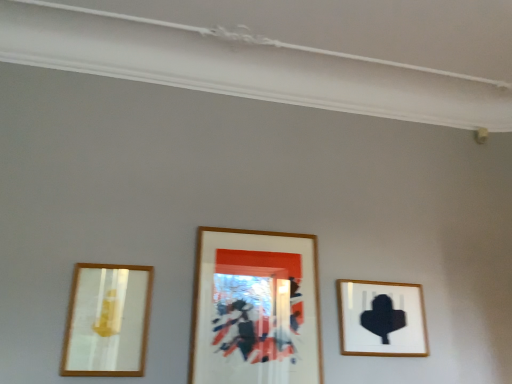
Question: Is point (113, 304) closer or farther from the camera than point (371, 332)?

Choices:
 (A) closer
 (B) farther

Answer: (A)

Question: Is matte gold mirror at left, arranged as the third picture frame when viewed from the right, spatially inside matte black silhouette at right, which is counted as the first picture frame, starting from the right, or outside of it?

Choices:
 (A) outside
 (B) inside

Answer: (A)

Question: Which of these objects is positioned closest to the matte gold mirror at left, arranged as the third picture frame when viewed from the right?

Choices:
 (A) matte black silhouette at right, which is counted as the first picture frame, starting from the right
 (B) wooden framed artwork at center, the second picture frame when ordered from left to right

Answer: (B)

Question: Which is farther from the matte gold mirror at left, arranged as the third picture frame when viewed from the right?

Choices:
 (A) matte black silhouette at right, the 3th picture frame when ordered from left to right
 (B) wooden framed artwork at center, the second picture frame when ordered from left to right

Answer: (A)